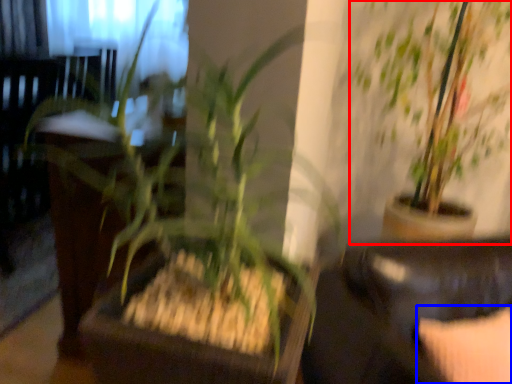
Question: Which point is closer to the camera, houseplant (highlighted by a red box) or pillow (highlighted by a blue box)?

Choices:
 (A) houseplant
 (B) pillow

Answer: (B)